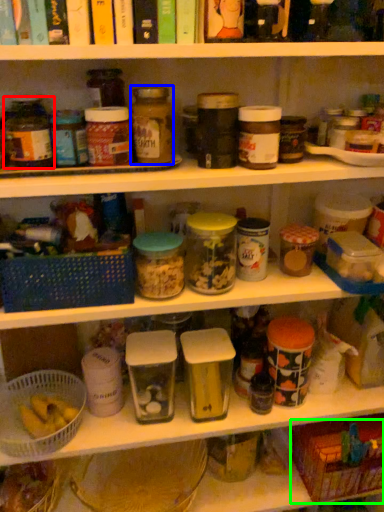
Question: Which object is the farthest from bottle (highlighted by a red box)? Choose among these: bottle (highlighted by a blue box) or basket (highlighted by a green box).

Choices:
 (A) bottle
 (B) basket

Answer: (B)